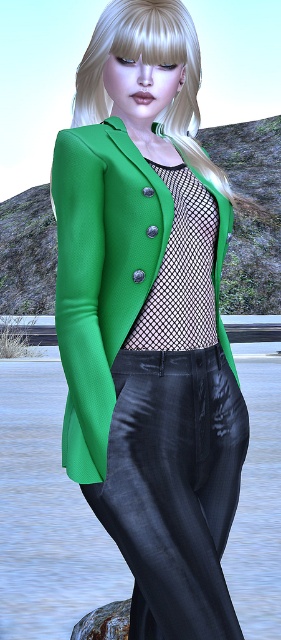
Can you confirm if shiny black pants at center is smaller than green textured coat at center?

Yes, shiny black pants at center is smaller than green textured coat at center.

Does shiny black pants at center lie behind green textured coat at center?

Yes, shiny black pants at center is further from the viewer.

Who is more distant from viewer, (116,406) or (60,138)?

The point (60,138) is more distant.

Locate an element on the screen. This screenshot has width=281, height=640. shiny black pants at center is located at coordinates (173, 486).